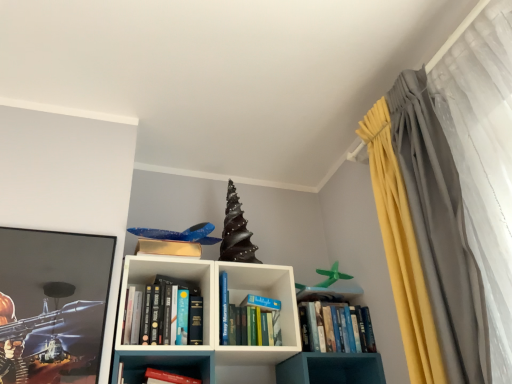
This screenshot has height=384, width=512. I want to click on hardcover book at center, so click(262, 302).

What do you see at coordinates (445, 237) in the screenshot?
I see `silky gray curtain at right` at bounding box center [445, 237].

Image resolution: width=512 pixels, height=384 pixels. Describe the element at coordinates (161, 312) in the screenshot. I see `hardcover books at center, which ranks as the third book in right-to-left order` at that location.

I want to click on metallic glossy picture frame at left, so click(x=52, y=305).

This screenshot has height=384, width=512. I want to click on hardcover book at center, which is counted as the second book, starting from the right, so click(x=168, y=377).

Considering the positions of objects white matte bookshelf at center and silky gray curtain at right in the image provided, who is more to the right, white matte bookshelf at center or silky gray curtain at right?

silky gray curtain at right.

From a real-world perspective, is white matte bookshelf at center above or below silky gray curtain at right?

In terms of real-world spatial position, white matte bookshelf at center is below silky gray curtain at right.

Image resolution: width=512 pixels, height=384 pixels. What are the coordinates of `curtain on the right of white matte bookshelf at center` in the screenshot? It's located at (445, 237).

Is white matte bookshelf at center directly adjacent to silky gray curtain at right?

They are not placed beside each other.

In the scene shown: Considering the sizes of metallic glossy picture frame at left and white matte bookshelf at center in the image, is metallic glossy picture frame at left bigger or smaller than white matte bookshelf at center?

In the image, metallic glossy picture frame at left appears to be smaller than white matte bookshelf at center.

Can you confirm if metallic glossy picture frame at left is positioned to the right of white matte bookshelf at center?

No.

Which object is thinner, metallic glossy picture frame at left or white matte bookshelf at center?

Thinner between the two is metallic glossy picture frame at left.

Consider the image. Is metallic glossy picture frame at left taller than white matte bookshelf at center?

Yes, metallic glossy picture frame at left is taller than white matte bookshelf at center.

From the picture: Can you confirm if white matte bookshelf at center is taller than hardcover books at center, which ranks as the third book in right-to-left order?

Indeed, white matte bookshelf at center has a greater height compared to hardcover books at center, which ranks as the third book in right-to-left order.

At what (x,y) coordinates should I click in order to perform the action: click on shelf located below the hardcover books at center, placed as the 1th book when sorted from left to right (from the image's perspective). Please return your answer as a coordinate pair (x, y). Looking at the image, I should click on (218, 314).

In the scene shown: Is white matte bookshelf at center directly adjacent to hardcover books at center, which ranks as the third book in right-to-left order?

No.

Relative to hardcover books at center, which ranks as the third book in right-to-left order, is white matte bookshelf at center in front or behind?

white matte bookshelf at center is positioned closer to the viewer than hardcover books at center, which ranks as the third book in right-to-left order.

Which point is more forward, (152,377) or (122,302)?

Positioned in front is point (152,377).

I want to click on the 1st book to the left of the white matte bookshelf at center, starting your count from the anchor, so click(168, 377).

Is hardcover book at center, which is counted as the second book, starting from the right, facing away from white matte bookshelf at center?

That's right, hardcover book at center, which is counted as the second book, starting from the right, is facing away from white matte bookshelf at center.

How many degrees apart are the facing directions of hardcover book at center, which appears as the second book when viewed from the left, and white matte bookshelf at center?

The angle between the facing direction of hardcover book at center, which appears as the second book when viewed from the left, and the facing direction of white matte bookshelf at center is 2.52 degrees.

Which object is further away from the camera, hardcover book at center or blue hardcover book at center, acting as the first book starting from the right?

hardcover book at center is behind.

Between hardcover book at center and blue hardcover book at center, placed as the 3th book when sorted from left to right, which one has smaller size?

Smaller between the two is hardcover book at center.

From the image's perspective, is hardcover book at center beneath blue hardcover book at center, placed as the 3th book when sorted from left to right?

No.

Considering the sizes of hardcover book at center and blue hardcover book at center, acting as the first book starting from the right, in the image, is hardcover book at center taller or shorter than blue hardcover book at center, acting as the first book starting from the right,?

Considering their sizes, hardcover book at center has less height than blue hardcover book at center, acting as the first book starting from the right.

The image size is (512, 384). Identify the location of the 2nd book in front of the blue hardcover book at center, placed as the 3th book when sorted from left to right, counting from the anchor's position. (168, 377).

Based on the photo, is blue hardcover book at center, acting as the first book starting from the right, at the right side of hardcover book at center, which appears as the second book when viewed from the left?

Correct, you'll find blue hardcover book at center, acting as the first book starting from the right, to the right of hardcover book at center, which appears as the second book when viewed from the left.

In the scene shown: In terms of height, does blue hardcover book at center, placed as the 3th book when sorted from left to right, look taller or shorter compared to hardcover book at center, which is counted as the second book, starting from the right?

blue hardcover book at center, placed as the 3th book when sorted from left to right, is taller than hardcover book at center, which is counted as the second book, starting from the right.

Considering the sizes of blue hardcover book at center, acting as the first book starting from the right, and hardcover book at center, which is counted as the second book, starting from the right, in the image, is blue hardcover book at center, acting as the first book starting from the right, bigger or smaller than hardcover book at center, which is counted as the second book, starting from the right,?

Clearly, blue hardcover book at center, acting as the first book starting from the right, is larger in size than hardcover book at center, which is counted as the second book, starting from the right.

Which is more to the left, white matte bookshelf at center or blue hardcover book at center, placed as the 3th book when sorted from left to right?

white matte bookshelf at center is more to the left.

Is white matte bookshelf at center far away from blue hardcover book at center, acting as the first book starting from the right?

No, there isn't a large distance between white matte bookshelf at center and blue hardcover book at center, acting as the first book starting from the right.

Considering the points (123, 282) and (368, 344), which point is in front, point (123, 282) or point (368, 344)?

Point (123, 282)

Between white matte bookshelf at center and blue hardcover book at center, placed as the 3th book when sorted from left to right, which one has smaller width?

Thinner between the two is blue hardcover book at center, placed as the 3th book when sorted from left to right.

I want to click on curtain located on the right of white matte bookshelf at center, so click(445, 237).

Locate an element on the screen. shelf behind the metallic glossy picture frame at left is located at coordinates (218, 314).

From the image, which object appears to be farther from metallic glossy picture frame at left, white matte bookshelf at center or silky gray curtain at right?

silky gray curtain at right.

From the image, which object appears to be farther from hardcover book at center, which is counted as the second book, starting from the right, hardcover book at center or metallic glossy picture frame at left?

Based on the image, hardcover book at center appears to be further to hardcover book at center, which is counted as the second book, starting from the right.

When comparing their distances from white matte bookshelf at center, does hardcover books at center, which ranks as the third book in right-to-left order, or hardcover book at center, which is counted as the second book, starting from the right, seem further?

hardcover book at center, which is counted as the second book, starting from the right.

Considering their positions, is hardcover book at center positioned closer to hardcover book at center, which is counted as the second book, starting from the right, than silky gray curtain at right?

hardcover book at center lies closer to hardcover book at center, which is counted as the second book, starting from the right, than the other object.

Considering their positions, is hardcover book at center, which is counted as the second book, starting from the right, positioned closer to metallic glossy picture frame at left than hardcover book at center?

Answer: hardcover book at center, which is counted as the second book, starting from the right, is closer to metallic glossy picture frame at left.

Based on their spatial positions, is hardcover book at center, which appears as the second book when viewed from the left, or blue hardcover book at center, acting as the first book starting from the right, closer to white matte bookshelf at center?

blue hardcover book at center, acting as the first book starting from the right, is closer to white matte bookshelf at center.

From the image, which object appears to be nearer to hardcover book at center, which is counted as the second book, starting from the right, hardcover books at center, which ranks as the third book in right-to-left order, or metallic glossy picture frame at left?

hardcover books at center, which ranks as the third book in right-to-left order.

Which object lies nearer to the anchor point hardcover book at center, metallic glossy picture frame at left or hardcover books at center, which ranks as the third book in right-to-left order?

Among the two, hardcover books at center, which ranks as the third book in right-to-left order, is located nearer to hardcover book at center.

Identify the location of shelf situated between hardcover books at center, which ranks as the third book in right-to-left order, and silky gray curtain at right from left to right. (218, 314).

Image resolution: width=512 pixels, height=384 pixels. I want to click on book between hardcover books at center, placed as the 1th book when sorted from left to right, and blue hardcover book at center, acting as the first book starting from the right, in the horizontal direction, so click(x=168, y=377).

Locate an element on the screen. Image resolution: width=512 pixels, height=384 pixels. paperback book situated between hardcover books at center, which ranks as the third book in right-to-left order, and blue hardcover book at center, placed as the 3th book when sorted from left to right, from left to right is located at coordinates (262, 302).

Image resolution: width=512 pixels, height=384 pixels. Identify the location of shelf between hardcover book at center, which is counted as the second book, starting from the right, and blue hardcover book at center, placed as the 3th book when sorted from left to right. (218, 314).